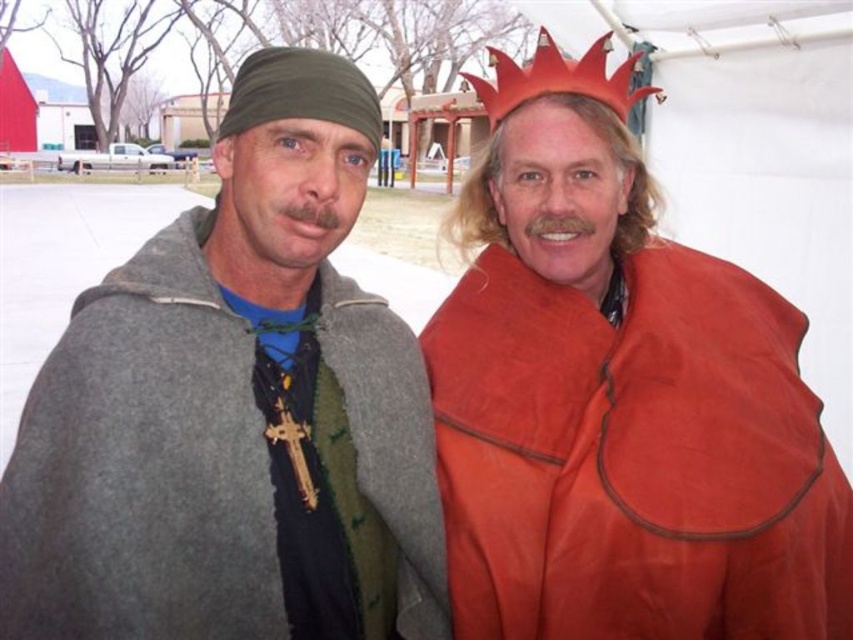
You are a photographer at an event and need to capture both the gray woolen cape at left and the matte orange cape at right in a single frame. Considering their height difference, which cape should you adjust your camera angle to focus on to ensure both are fully visible?

The gray woolen cape at left is much taller than the matte orange cape at right. To ensure both are fully visible, you should adjust your camera angle to focus on the gray woolen cape at left, as it is taller and requires a lower angle to capture its full height while still including the shorter matte orange cape at right.

You are an artist sketching the scene and need to place the gray woolen cape at left accurately on your canvas. According to the coordinates provided, where should you position it?

The gray woolen cape at left should be positioned at the 2D coordinates point (235, 410).

You are a costume designer measuring the distance between two capes for a scene. The gray woolen cape at left and the matte orange cape at right are part of a historical drama set. Can the two capes fit side by side on a 1.5 meter wide display table without overlapping?

The gray woolen cape at left and matte orange cape at right are 71.68 centimeters apart. Since 71.68 cm is less than 150 cm, the combined width of both capes would be under 1.5 meters, so they can fit side by side without overlapping.